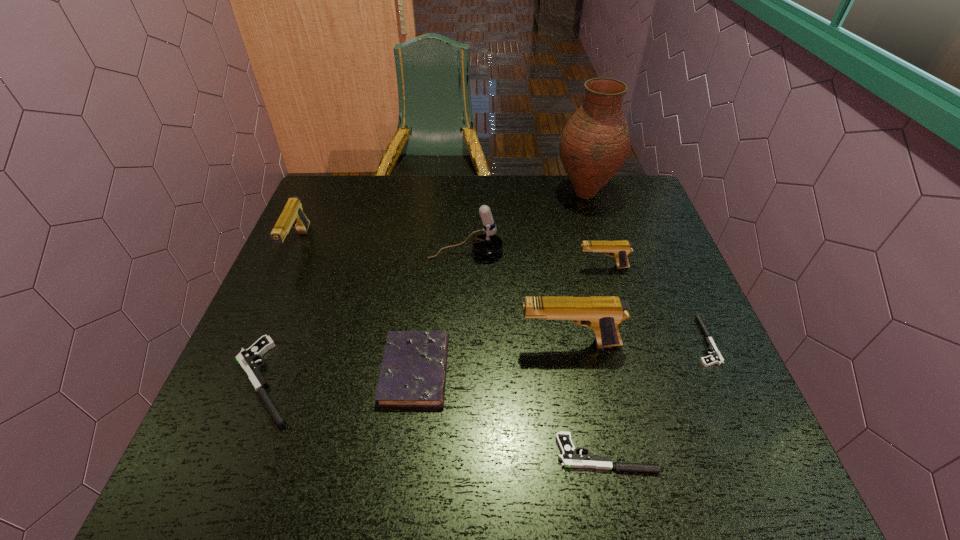
Identify which object is located as the fifth nearest to the biggest black pistol. Please provide its 2D coordinates. Your answer should be formatted as a tuple, i.e. [(x, y)], where the tuple contains the x and y coordinates of a point satisfying the conditions above.

[(569, 458)]

Where is `the fifth closest object to the tallest pistol`? The width and height of the screenshot is (960, 540). the fifth closest object to the tallest pistol is located at coordinates (488, 244).

Choose which pistol is the nearest neighbor to the white microphone. Please provide its 2D coordinates. Your answer should be formatted as a tuple, i.e. [(x, y)], where the tuple contains the x and y coordinates of a point satisfying the conditions above.

[(619, 249)]

Select which pistol appears as the third closest to the fifth tallest pistol. Please provide its 2D coordinates. Your answer should be formatted as a tuple, i.e. [(x, y)], where the tuple contains the x and y coordinates of a point satisfying the conditions above.

[(619, 249)]

Locate an element on the screen. This screenshot has height=540, width=960. tan pistol that is the closest to the fifth tallest object is located at coordinates (603, 314).

Identify which tan pistol is located as the second nearest to the second smallest tan pistol. Please provide its 2D coordinates. Your answer should be formatted as a tuple, i.e. [(x, y)], where the tuple contains the x and y coordinates of a point satisfying the conditions above.

[(619, 249)]

Select which black pistol appears as the second closest to the rightmost black pistol. Please provide its 2D coordinates. Your answer should be formatted as a tuple, i.e. [(x, y)], where the tuple contains the x and y coordinates of a point satisfying the conditions above.

[(247, 358)]

Where is `black pistol that stands as the second closest to the shortest pistol`? This screenshot has height=540, width=960. black pistol that stands as the second closest to the shortest pistol is located at coordinates coord(247,358).

Where is `vacant space that satisfies the following two spatial constraints: 1. at the barrel of the sixth tallest object; 2. on the right side of the sixth shortest object`? vacant space that satisfies the following two spatial constraints: 1. at the barrel of the sixth tallest object; 2. on the right side of the sixth shortest object is located at coordinates (242, 370).

Where is `free point that satisfies the following two spatial constraints: 1. at the barrel of the fourth shortest object; 2. on the right side of the leftmost tan pistol`? free point that satisfies the following two spatial constraints: 1. at the barrel of the fourth shortest object; 2. on the right side of the leftmost tan pistol is located at coordinates (242, 370).